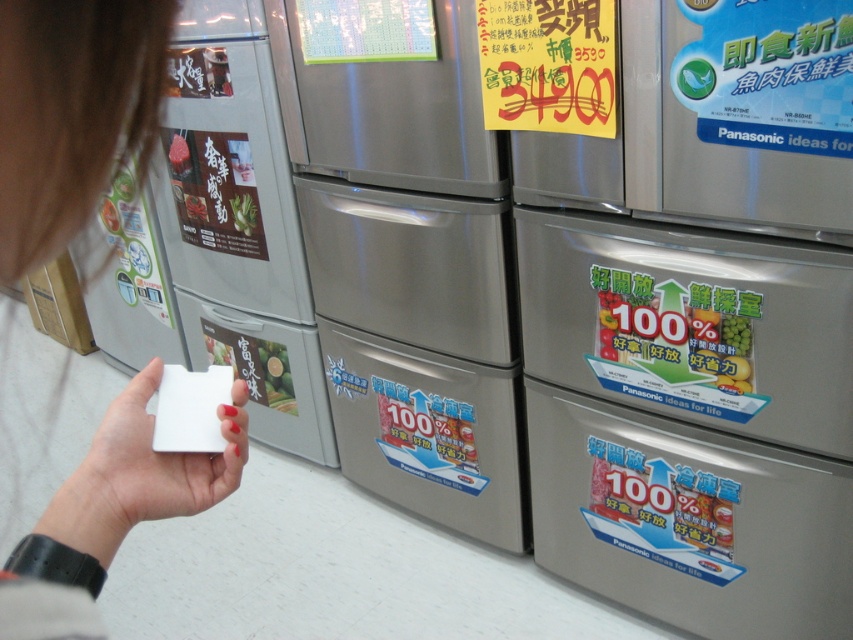
Question: Which object is farther from the camera taking this photo?

Choices:
 (A) satin silver refrigerator at left
 (B) green matte refrigerator at center
 (C) satin silver refrigerator at center

Answer: (A)

Question: Is stainless steel refrigerator at center closer to the viewer compared to white matte card at lower left?

Choices:
 (A) yes
 (B) no

Answer: (B)

Question: Considering the real-world distances, which object is farthest from the stainless steel refrigerator at center?

Choices:
 (A) white matte card at lower left
 (B) satin silver refrigerator at center
 (C) green matte refrigerator at center
 (D) satin silver refrigerator at left

Answer: (A)

Question: Is the position of satin silver refrigerator at center less distant than that of white matte card at lower left?

Choices:
 (A) no
 (B) yes

Answer: (A)

Question: From the image, what is the correct spatial relationship of stainless steel refrigerator at center in relation to satin silver refrigerator at left?

Choices:
 (A) above
 (B) below

Answer: (B)

Question: Which point is closer to the camera taking this photo?

Choices:
 (A) (740, 369)
 (B) (688, 573)

Answer: (A)